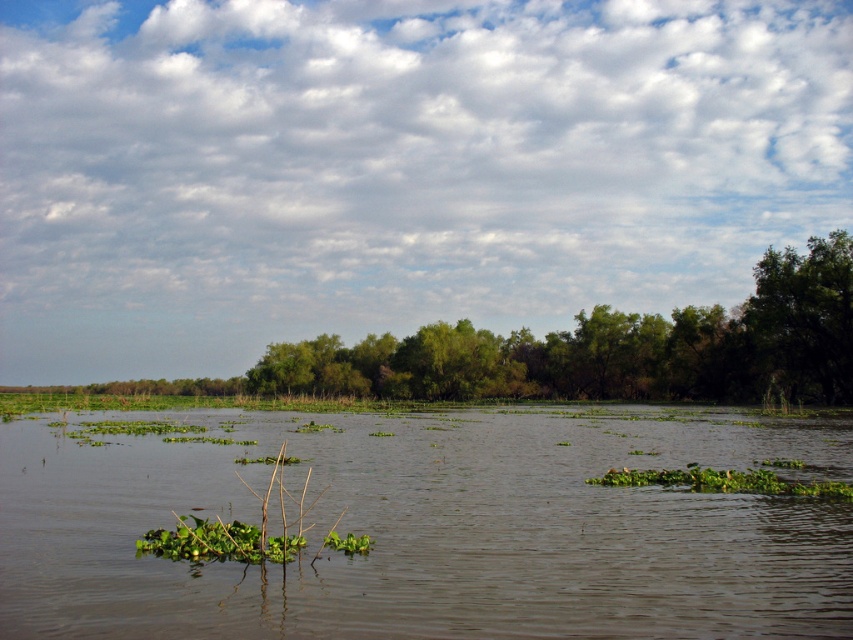
Based on the photo, between green leafy vegetation at center and green leafy tree at right, which one is positioned lower?

green leafy vegetation at center

Is green leafy vegetation at center shorter than green leafy tree at right?

Indeed, green leafy vegetation at center has a lesser height compared to green leafy tree at right.

Where is `green leafy vegetation at center`? Image resolution: width=853 pixels, height=640 pixels. green leafy vegetation at center is located at coordinates (431, 528).

Can you confirm if green leafy vegetation at center is thinner than green leafy plant at center?

In fact, green leafy vegetation at center might be wider than green leafy plant at center.

Is point (234, 444) closer to viewer compared to point (292, 547)?

That is False.

Where is `green leafy vegetation at center`? green leafy vegetation at center is located at coordinates (431, 528).

Between green leafy tree at right and green leafy plant at center, which one is positioned higher?

Positioned higher is green leafy tree at right.

Does green leafy tree at right lie in front of green leafy plant at center?

No.

What do you see at coordinates (804, 317) in the screenshot? I see `green leafy tree at right` at bounding box center [804, 317].

Find the location of a particular element. Image resolution: width=853 pixels, height=640 pixels. green leafy tree at right is located at coordinates (804, 317).